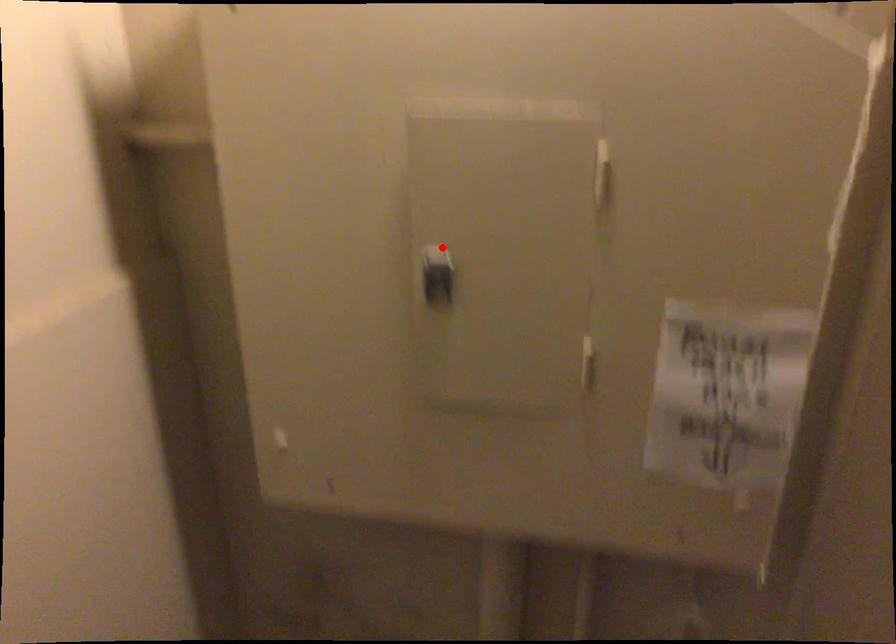
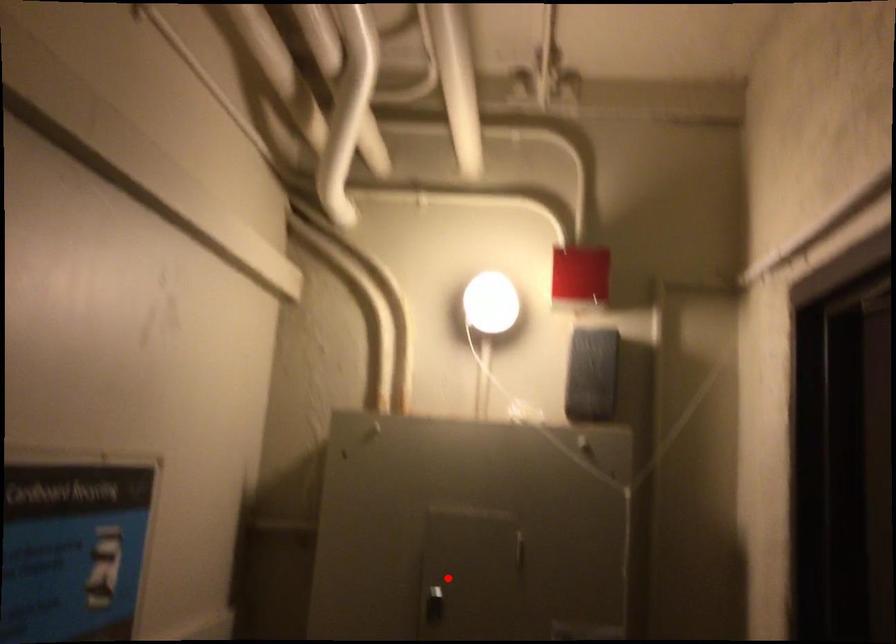
I am providing you with two images of the same scene from different viewpoints. A red point is marked on the first image and another point is marked on the second image. Does the point marked in image1 correspond to the same location as the one in image2?

Yes